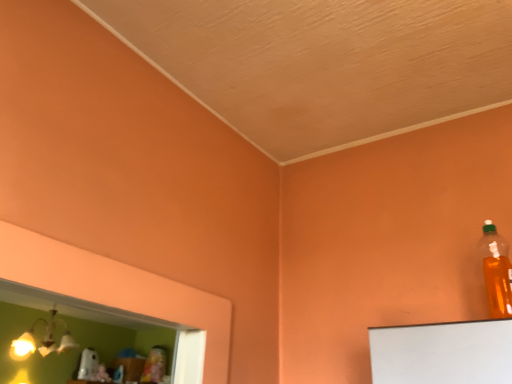
This screenshot has height=384, width=512. Describe the element at coordinates (496, 271) in the screenshot. I see `translucent orange bottle at upper right` at that location.

Where is `translucent orange bottle at upper right`? The image size is (512, 384). translucent orange bottle at upper right is located at coordinates (496, 271).

At what (x,y) coordinates should I click in order to perform the action: click on translucent orange bottle at upper right. Please return your answer as a coordinate pair (x, y). This screenshot has height=384, width=512. Looking at the image, I should click on (496, 271).